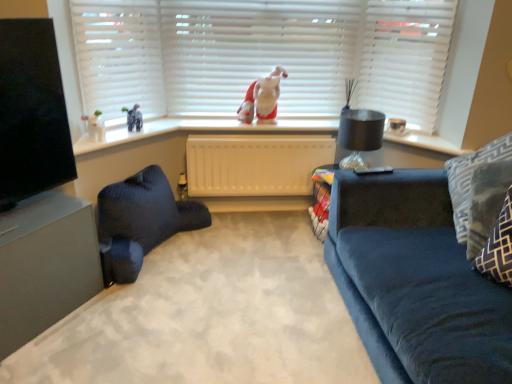
Question: From the image's perspective, relative to white matte blinds at upper center, is white matte blinds at upper center above or below?

Choices:
 (A) above
 (B) below

Answer: (A)

Question: Choose the correct answer: Is white matte blinds at upper center inside white matte blinds at upper center or outside it?

Choices:
 (A) inside
 (B) outside

Answer: (B)

Question: Which is nearer to the white matte shutter at upper right?

Choices:
 (A) white matte radiator at center
 (B) patterned fabric pillow at right, the second pillow from the front
 (C) black glass lamp at upper right
 (D) white matte blinds at upper center
 (E) black matte tv at left

Answer: (C)

Question: Which object is the farthest from the black glass lamp at upper right?

Choices:
 (A) white matte blinds at upper center
 (B) patterned fabric pillow at right, the second pillow from the front
 (C) black matte tv at left
 (D) white matte blinds at upper center
 (E) fuzzy fabric santa at center

Answer: (C)